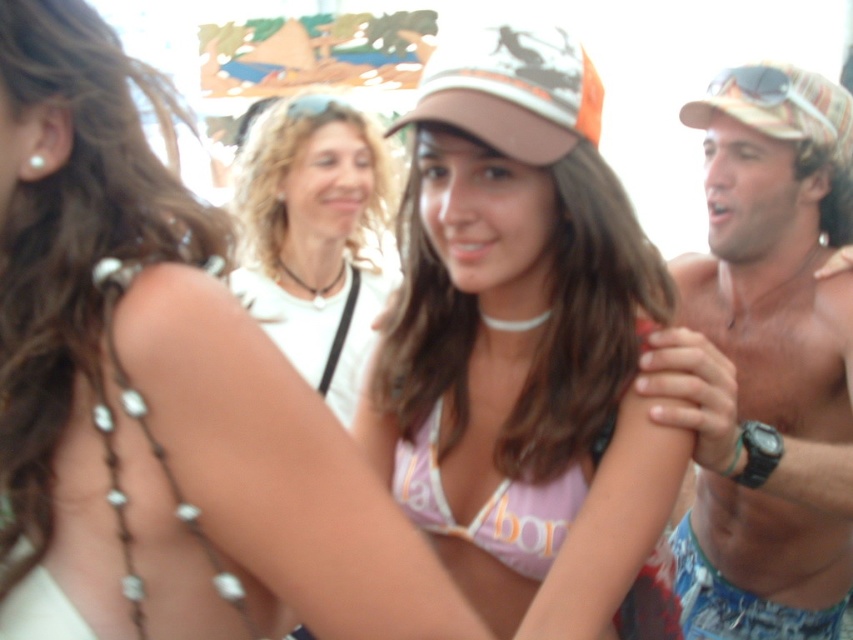
The width and height of the screenshot is (853, 640). What do you see at coordinates (524, 349) in the screenshot?
I see `matte pink bikini top at center` at bounding box center [524, 349].

Can you confirm if matte pink bikini top at center is positioned to the right of camouflage fabric baseball cap at center?

Correct, you'll find matte pink bikini top at center to the right of camouflage fabric baseball cap at center.

The image size is (853, 640). What do you see at coordinates (524, 349) in the screenshot?
I see `matte pink bikini top at center` at bounding box center [524, 349].

Where is `matte pink bikini top at center`? The width and height of the screenshot is (853, 640). matte pink bikini top at center is located at coordinates (524, 349).

Consider the image. Can you confirm if camouflage fabric cap at right is positioned below white matte shirt at center?

Indeed, camouflage fabric cap at right is positioned under white matte shirt at center.

What do you see at coordinates (764, 362) in the screenshot? I see `camouflage fabric cap at right` at bounding box center [764, 362].

At what (x,y) coordinates should I click in order to perform the action: click on camouflage fabric cap at right. Please return your answer as a coordinate pair (x, y). Image resolution: width=853 pixels, height=640 pixels. Looking at the image, I should click on (764, 362).

Describe the element at coordinates (315, 236) in the screenshot. This screenshot has height=640, width=853. I see `white matte shirt at center` at that location.

Which is behind, point (337, 307) or point (567, 120)?

The point (337, 307) is behind.

Where is `white matte shirt at center`? This screenshot has height=640, width=853. white matte shirt at center is located at coordinates (315, 236).